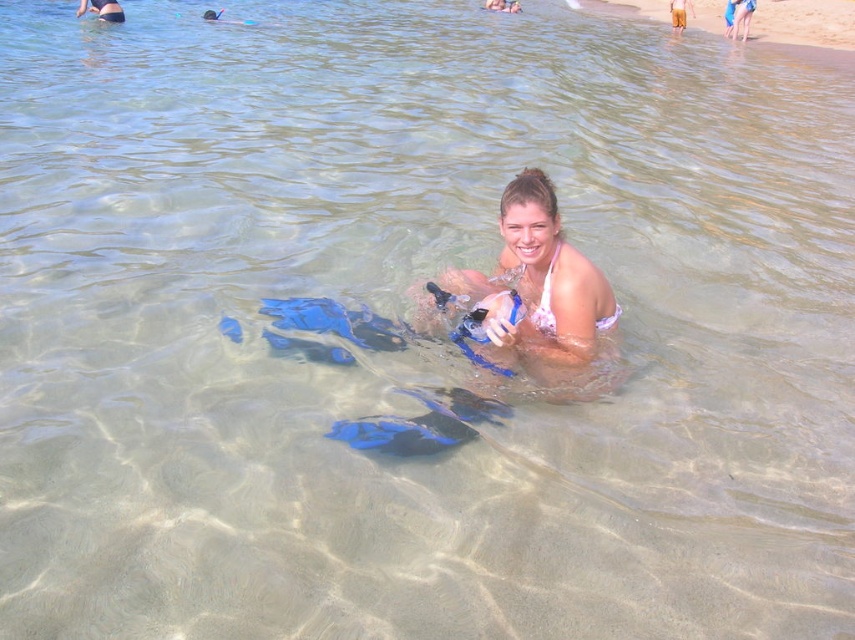
Is white bikini at center closer to camera compared to pink fabric bikini at upper center?

Yes, white bikini at center is in front of pink fabric bikini at upper center.

Is point (472, 296) positioned before point (121, 20)?

Yes, it is in front of point (121, 20).

The width and height of the screenshot is (855, 640). In order to click on white bikini at center in this screenshot , I will do `click(540, 294)`.